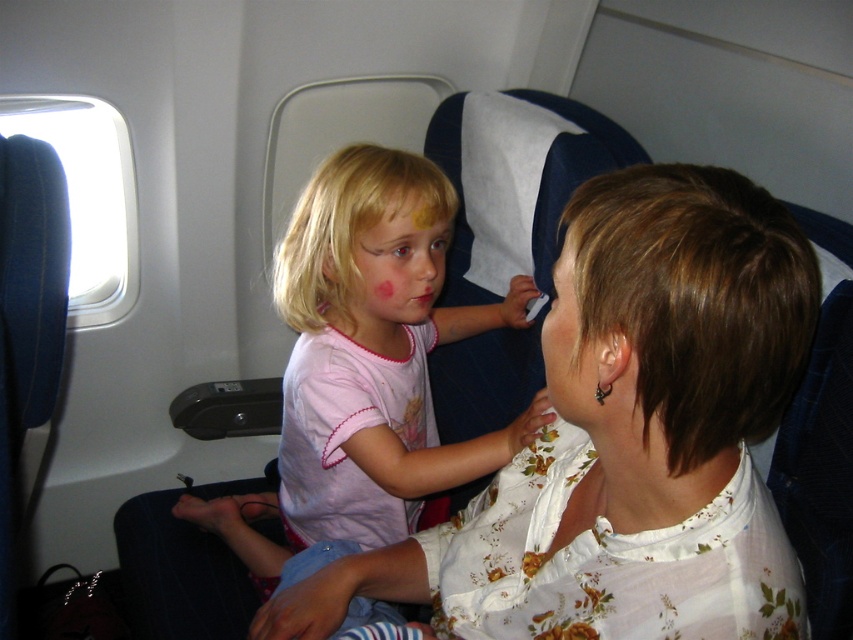
Question: Among these points, which one is nearest to the camera?

Choices:
 (A) (595, 388)
 (B) (683, 433)
 (C) (403, 280)

Answer: (B)

Question: Does white floral blouse at center have a smaller size compared to light pink fabric face at center?

Choices:
 (A) no
 (B) yes

Answer: (A)

Question: Observing the image, what is the correct spatial positioning of white floral blouse at center in reference to pink fabric shirt at center?

Choices:
 (A) left
 (B) right

Answer: (B)

Question: Which object is closer to the camera taking this photo?

Choices:
 (A) light pink fabric face at center
 (B) white floral blouse at center

Answer: (B)

Question: Among these objects, which one is farthest from the camera?

Choices:
 (A) pink fabric shirt at center
 (B) matte white ear at center

Answer: (A)

Question: Does light pink fabric face at center appear on the right side of matte white ear at center?

Choices:
 (A) no
 (B) yes

Answer: (A)